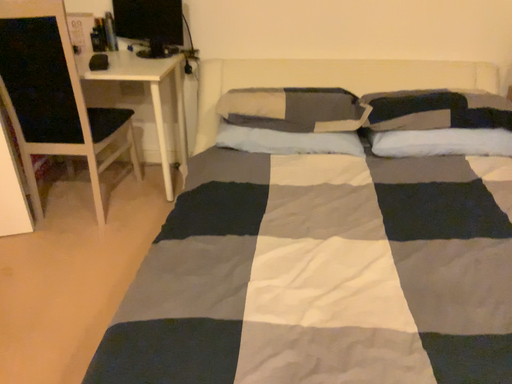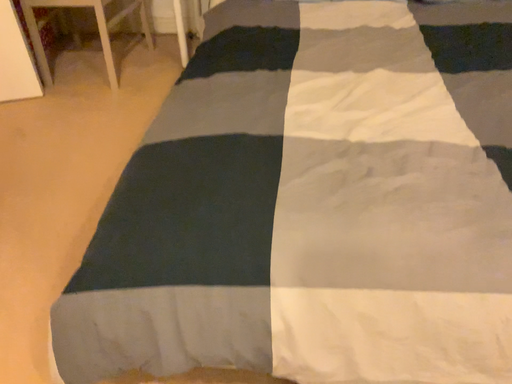
Question: Which way did the camera rotate in the video?

Choices:
 (A) rotated downward
 (B) rotated upward

Answer: (A)